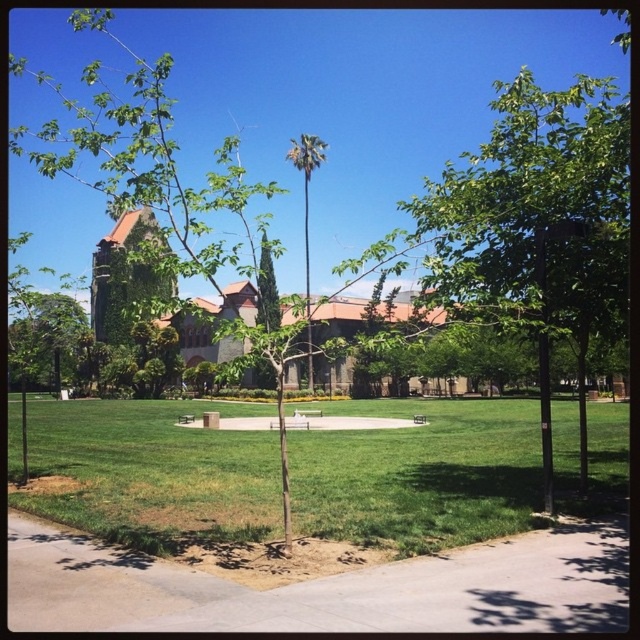
Question: Which point is closer to the camera?

Choices:
 (A) (305, 412)
 (B) (310, 356)
 (C) (179, 419)
 (D) (378, 532)

Answer: (D)

Question: Which object is farther from the camera taking this photo?

Choices:
 (A) brown wooden bench at center
 (B) gray concrete sidewalk at lower center

Answer: (A)

Question: Which point is closer to the camera?

Choices:
 (A) (272, 291)
 (B) (300, 413)
 (C) (292, 426)

Answer: (C)

Question: Can you confirm if green grassy area at center is positioned above green leafy tree at center?

Choices:
 (A) yes
 (B) no

Answer: (B)

Question: Is gray concrete sidewalk at lower center wider than green leafy tree at center?

Choices:
 (A) yes
 (B) no

Answer: (B)

Question: Is wooden park bench at center above brown wooden park bench at center?

Choices:
 (A) no
 (B) yes

Answer: (A)